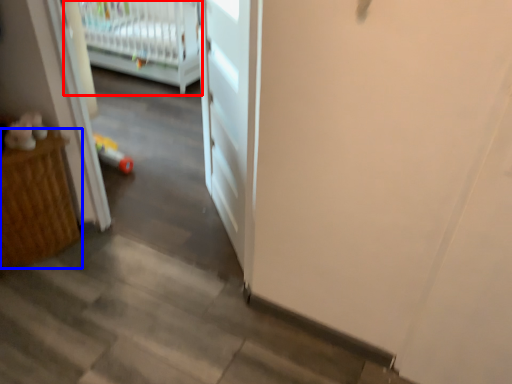
Question: Which point is closer to the camera, infant bed (highlighted by a red box) or furniture (highlighted by a blue box)?

Choices:
 (A) infant bed
 (B) furniture

Answer: (B)